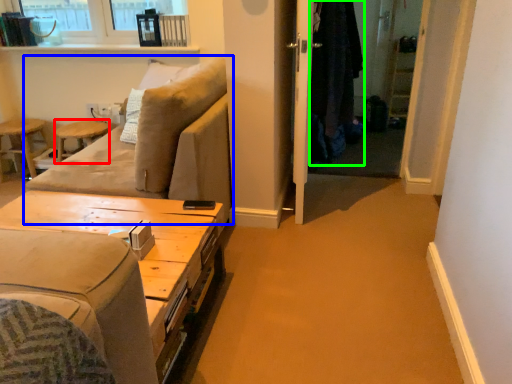
Question: Which object is the closest to the bar stool (highlighted by a red box)? Choose among these: studio couch (highlighted by a blue box) or robe (highlighted by a green box).

Choices:
 (A) studio couch
 (B) robe

Answer: (A)